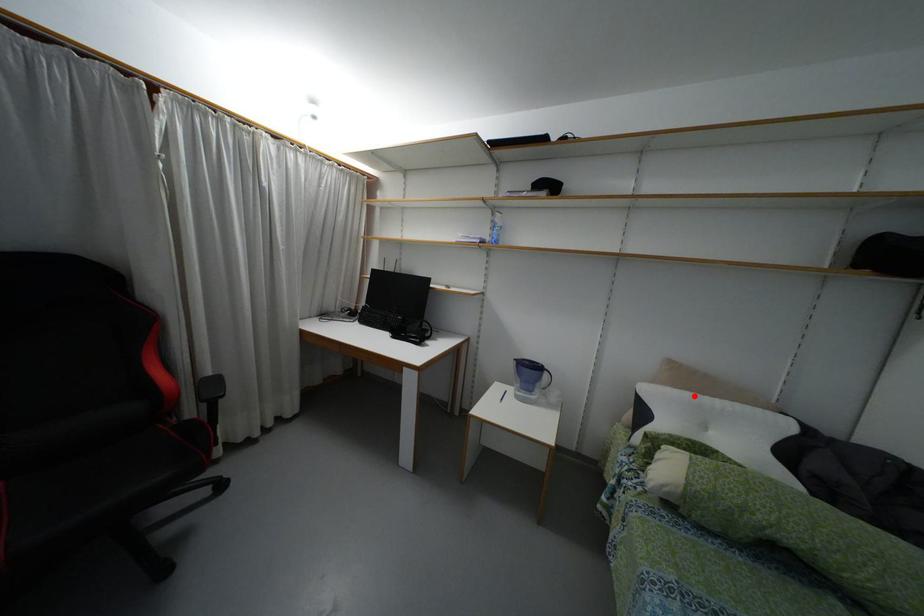
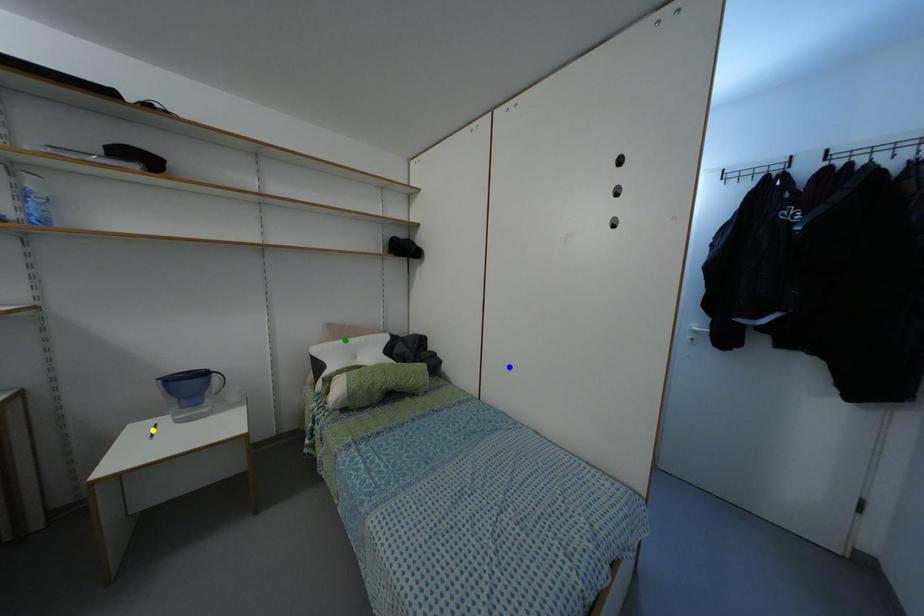
Question: I am providing you with two images of the same scene from different viewpoints. A red point is marked on the first image. You are given multiple points on the second image. Which mark in image 2 goes with the point in image 1?

Choices:
 (A) blue point
 (B) green point
 (C) yellow point

Answer: (B)